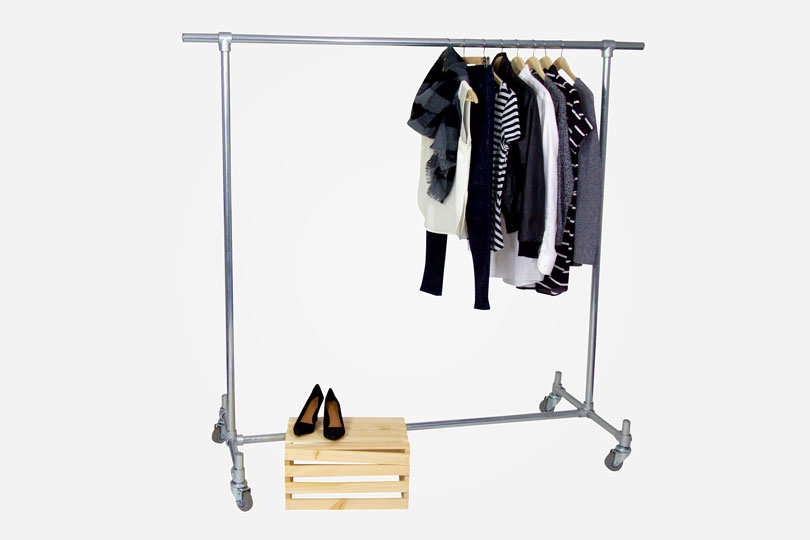
This screenshot has height=540, width=810. Identify the location of clothing rack wheels. (215, 430), (244, 500), (546, 404), (614, 464).